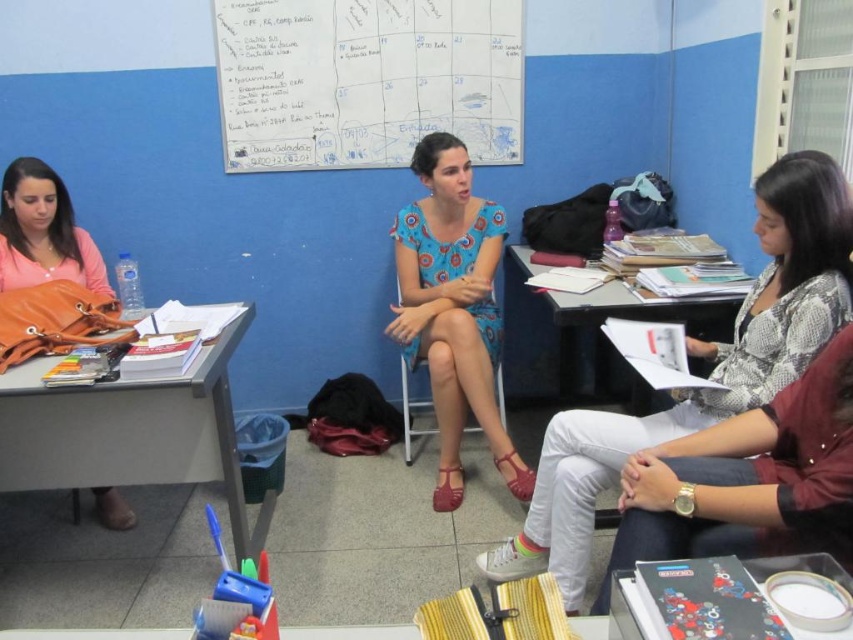
In the scene shown: You are organizing a fashion show and need to place two dresses on a mannequin stand that is 30 inches wide. The blue floral dress at center and the blue printed dress at center must be displayed side by side. Will both dresses fit on the stand without overlapping?

The blue floral dress at center is 31.35 inches from the blue printed dress at center, so the total width required would be the sum of their individual widths. However, the distance between them is already 31.35 inches, which exceeds the 30 inch stand width. Therefore, they cannot be placed side by side without overlapping.

From the picture: You are standing at the white paperboard at upper center and want to reach the door located on the opposite wall. The door is 2.5 meters away from you. Can you walk straight to the door without any obstacles?

The distance between the white paperboard at upper center and the door is 2.5 meters, so yes, you can walk straight to the door without any obstacles since the distance is within the clear path.